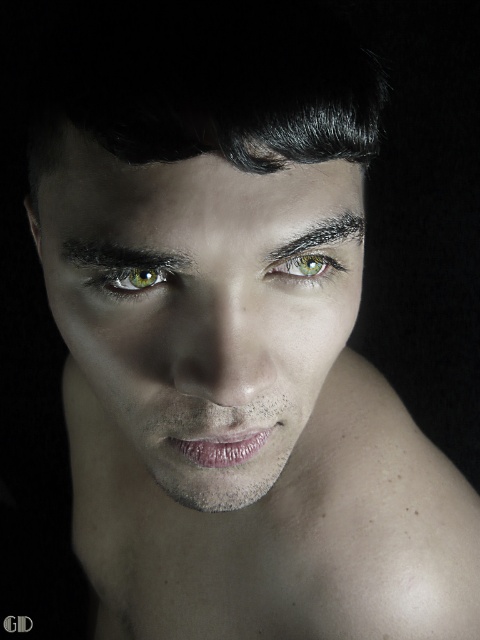
Is smooth skin face at center positioned at the back of smooth skin at lower center?

No.

Is point (289, 198) positioned behind point (447, 472)?

No.

Image resolution: width=480 pixels, height=640 pixels. In order to click on smooth skin face at center in this screenshot , I will do `click(201, 305)`.

Does smooth skin face at center have a smaller size compared to green matte eye at upper center?

Incorrect, smooth skin face at center is not smaller in size than green matte eye at upper center.

Who is more distant from viewer, (x=151, y=180) or (x=119, y=262)?

The point (x=119, y=262) is behind.

Where is `smooth skin face at center`? smooth skin face at center is located at coordinates (201, 305).

Which is more to the right, smooth skin at lower center or green matte eye at center?

green matte eye at center

Who is higher up, smooth skin at lower center or green matte eye at center?

green matte eye at center is above.

Where is `smooth skin at lower center`? This screenshot has width=480, height=640. smooth skin at lower center is located at coordinates (276, 522).